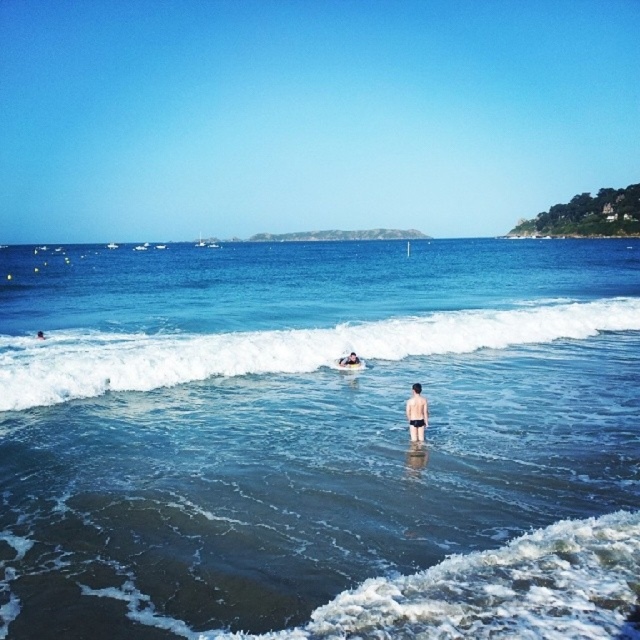
You are standing on the beach and see the blue clear water at center and the skinny man at lower center. Which object is positioned to the right of the other?

The blue clear water at center is to the right of the skinny man at lower center.

You are a swimmer standing on the beach looking at the white foamy wave at center and the skinny man at lower center. Which object is closer to you?

The white foamy wave at center is positioned over the skinny man at lower center, meaning the wave is closer to you since it is in front of the man.